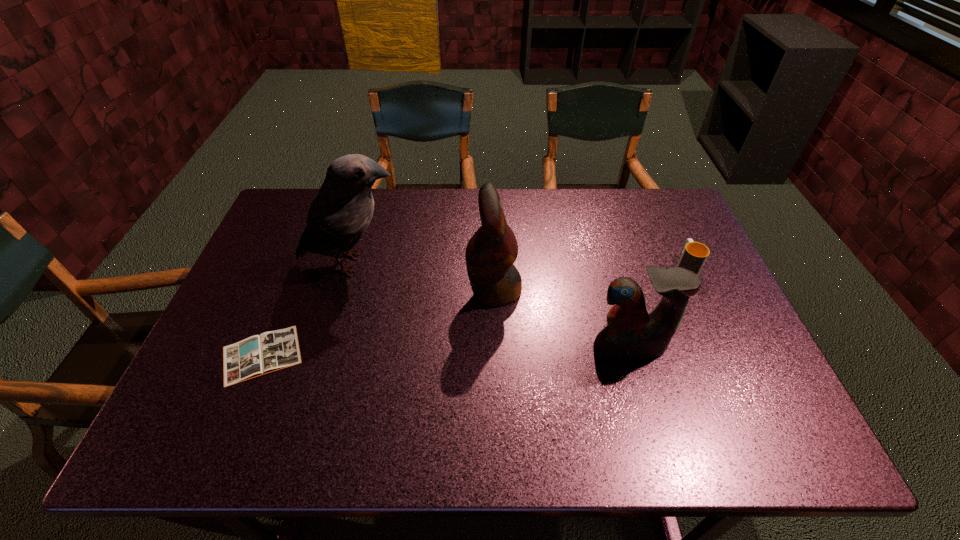
I want to click on vacant area at the near edge, so click(x=332, y=415).

Where is `vacant space at the left edge of the desktop`? vacant space at the left edge of the desktop is located at coordinates (266, 287).

The width and height of the screenshot is (960, 540). I want to click on vacant space at the right edge, so click(x=696, y=360).

You are a GUI agent. You are given a task and a screenshot of the screen. Output one action in this format:
    pyautogui.click(x=<x>, y=<y>)
    Task: Click on the vacant space at the far left corner
    
    Given the screenshot: What is the action you would take?
    pyautogui.click(x=298, y=227)

Locate an element on the screen. This screenshot has width=960, height=540. free space at the near right corner of the desktop is located at coordinates (748, 437).

This screenshot has width=960, height=540. I want to click on vacant area between the shortest object and the leftmost parrot, so [307, 309].

Identify the location of free spot between the fourth tallest object and the leftmost parrot. pos(519,265).

Find the location of a particular element. vacant area that lies between the second shortest object and the leftmost parrot is located at coordinates (519, 265).

This screenshot has height=540, width=960. Find the location of `blank region between the leftmost parrot and the book`. blank region between the leftmost parrot and the book is located at coordinates (307, 309).

Where is `vacant area between the leftmost parrot and the second parrot from right to left`? This screenshot has height=540, width=960. vacant area between the leftmost parrot and the second parrot from right to left is located at coordinates (423, 277).